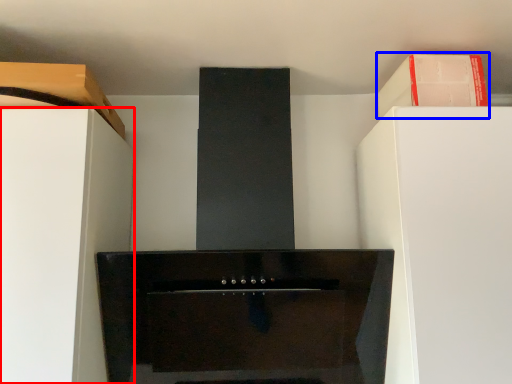
Question: Which object is closer to the camera taking this photo, furniture (highlighted by a red box) or cabinetry (highlighted by a blue box)?

Choices:
 (A) furniture
 (B) cabinetry

Answer: (A)